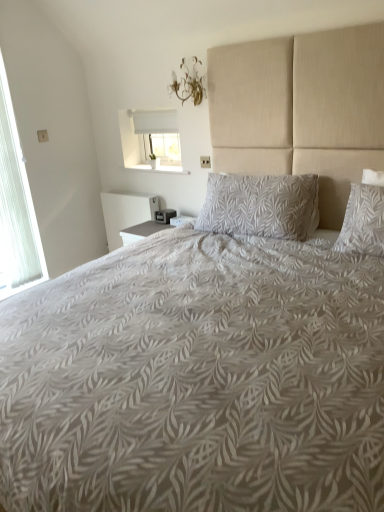
Describe the element at coordinates (261, 206) in the screenshot. This screenshot has width=384, height=512. I see `gray leaf-patterned pillow at center` at that location.

Locate an element on the screen. gray leaf-patterned pillow at center is located at coordinates (261, 206).

Where is `white fabric window at upper center, placed as the first window when sorted from right to left`? This screenshot has width=384, height=512. white fabric window at upper center, placed as the first window when sorted from right to left is located at coordinates (151, 140).

Image resolution: width=384 pixels, height=512 pixels. I want to click on gold metallic chandelier at upper center, so click(x=188, y=83).

The width and height of the screenshot is (384, 512). In order to click on window that appears on the left of white fabric window at upper center, placed as the 2th window when sorted from left to right in this screenshot , I will do `click(16, 206)`.

From the image's perspective, is white sheer curtain at left, which appears as the first window when viewed from the left, located above or below white fabric window at upper center, placed as the 2th window when sorted from left to right?

white sheer curtain at left, which appears as the first window when viewed from the left, is below white fabric window at upper center, placed as the 2th window when sorted from left to right.

Is white sheer curtain at left, which is the 2th window in right-to-left order, looking in the opposite direction of white fabric window at upper center, placed as the 2th window when sorted from left to right?

No, white sheer curtain at left, which is the 2th window in right-to-left order, is not facing the opposite direction of white fabric window at upper center, placed as the 2th window when sorted from left to right.

Which of these two, white fabric window at upper center, placed as the 2th window when sorted from left to right, or gray leaf-patterned pillow at center, is thinner?

white fabric window at upper center, placed as the 2th window when sorted from left to right, is thinner.

Is white fabric window at upper center, placed as the first window when sorted from right to left, facing away from gray leaf-patterned pillow at center?

No, gray leaf-patterned pillow at center is not at the back of white fabric window at upper center, placed as the first window when sorted from right to left.

From a real-world perspective, which object stands above the other?

white fabric window at upper center, placed as the first window when sorted from right to left, from a real-world perspective.

From a real-world perspective, who is located lower, white sheer curtain at left, which appears as the first window when viewed from the left, or gray leaf-patterned pillow at center?

gray leaf-patterned pillow at center.

Which of these two, white sheer curtain at left, which appears as the first window when viewed from the left, or gray leaf-patterned pillow at center, is bigger?

gray leaf-patterned pillow at center.

Which is more to the right, white sheer curtain at left, which appears as the first window when viewed from the left, or gray leaf-patterned pillow at center?

gray leaf-patterned pillow at center is more to the right.

Which object is closer to the camera taking this photo, white sheer curtain at left, which appears as the first window when viewed from the left, or gray leaf-patterned pillow at center?

gray leaf-patterned pillow at center.

This screenshot has height=512, width=384. Find the location of `light fixture behind the white sheer curtain at left, which appears as the first window when viewed from the left`. light fixture behind the white sheer curtain at left, which appears as the first window when viewed from the left is located at coordinates (188, 83).

From the picture: Is gold metallic chandelier at upper center thinner than white sheer curtain at left, which appears as the first window when viewed from the left?

No, gold metallic chandelier at upper center is not thinner than white sheer curtain at left, which appears as the first window when viewed from the left.

Is the surface of gold metallic chandelier at upper center in direct contact with white sheer curtain at left, which appears as the first window when viewed from the left?

They are not placed beside each other.

Who is taller, gray leaf-patterned pillow at center or white sheer curtain at left, which is the 2th window in right-to-left order?

With more height is white sheer curtain at left, which is the 2th window in right-to-left order.

Is point (290, 184) behind point (1, 127)?

No, (290, 184) is closer to viewer.

Is gray leaf-patterned pillow at center far away from white sheer curtain at left, which is the 2th window in right-to-left order?

Absolutely, gray leaf-patterned pillow at center is distant from white sheer curtain at left, which is the 2th window in right-to-left order.

How far apart are gray leaf-patterned pillow at center and white sheer curtain at left, which is the 2th window in right-to-left order?

A distance of 5.66 feet exists between gray leaf-patterned pillow at center and white sheer curtain at left, which is the 2th window in right-to-left order.

Is white fabric window at upper center, placed as the first window when sorted from right to left, with white sheer curtain at left, which appears as the first window when viewed from the left?

white fabric window at upper center, placed as the first window when sorted from right to left, is not next to white sheer curtain at left, which appears as the first window when viewed from the left, and they're not touching.

Could you tell me if white fabric window at upper center, placed as the 2th window when sorted from left to right, is facing white sheer curtain at left, which appears as the first window when viewed from the left?

Yes, white fabric window at upper center, placed as the 2th window when sorted from left to right, is facing white sheer curtain at left, which appears as the first window when viewed from the left.

Is white fabric window at upper center, placed as the first window when sorted from right to left, positioned before white sheer curtain at left, which is the 2th window in right-to-left order?

No, white fabric window at upper center, placed as the first window when sorted from right to left, is further to the viewer.

From a real-world perspective, is white fabric window at upper center, placed as the 2th window when sorted from left to right, below white sheer curtain at left, which appears as the first window when viewed from the left?

Actually, white fabric window at upper center, placed as the 2th window when sorted from left to right, is physically above white sheer curtain at left, which appears as the first window when viewed from the left, in the real world.

From the image's perspective, relative to white fabric window at upper center, placed as the 2th window when sorted from left to right, is gold metallic chandelier at upper center above or below?

gold metallic chandelier at upper center is above white fabric window at upper center, placed as the 2th window when sorted from left to right.

Considering the points (171, 83) and (173, 164), which point is in front, point (171, 83) or point (173, 164)?

The point (171, 83) is closer to the camera.

Considering the relative sizes of gold metallic chandelier at upper center and white fabric window at upper center, placed as the 2th window when sorted from left to right, in the image provided, is gold metallic chandelier at upper center wider than white fabric window at upper center, placed as the 2th window when sorted from left to right,?

Incorrect, the width of gold metallic chandelier at upper center does not surpass that of white fabric window at upper center, placed as the 2th window when sorted from left to right.

Locate an element on the screen. window beneath the white fabric window at upper center, placed as the 2th window when sorted from left to right (from a real-world perspective) is located at coordinates point(16,206).

Find the location of a particular element. The image size is (384, 512). window that is the 1st one when counting leftward from the gray leaf-patterned pillow at center is located at coordinates (151, 140).

From the image, which object appears to be nearer to white sheer curtain at left, which appears as the first window when viewed from the left, gold metallic chandelier at upper center or gray leaf-patterned pillow at center?

The object closer to white sheer curtain at left, which appears as the first window when viewed from the left, is gold metallic chandelier at upper center.

Estimate the real-world distances between objects in this image. Which object is further from white sheer curtain at left, which appears as the first window when viewed from the left, white fabric window at upper center, placed as the 2th window when sorted from left to right, or gray leaf-patterned pillow at center?

gray leaf-patterned pillow at center is further to white sheer curtain at left, which appears as the first window when viewed from the left.

From the image, which object appears to be farther from gray leaf-patterned pillow at center, gold metallic chandelier at upper center or white fabric window at upper center, placed as the first window when sorted from right to left?

white fabric window at upper center, placed as the first window when sorted from right to left, lies further to gray leaf-patterned pillow at center than the other object.

Estimate the real-world distances between objects in this image. Which object is further from gray leaf-patterned pillow at center, white fabric window at upper center, placed as the 2th window when sorted from left to right, or gold metallic chandelier at upper center?

white fabric window at upper center, placed as the 2th window when sorted from left to right, is positioned further to the anchor gray leaf-patterned pillow at center.

When comparing their distances from white sheer curtain at left, which is the 2th window in right-to-left order, does gray leaf-patterned pillow at center or gold metallic chandelier at upper center seem further?

Among the two, gray leaf-patterned pillow at center is located further to white sheer curtain at left, which is the 2th window in right-to-left order.

Which object lies nearer to the anchor point white fabric window at upper center, placed as the 2th window when sorted from left to right, gold metallic chandelier at upper center or gray leaf-patterned pillow at center?

gold metallic chandelier at upper center.

Estimate the real-world distances between objects in this image. Which object is further from white sheer curtain at left, which is the 2th window in right-to-left order, gray leaf-patterned pillow at center or white fabric window at upper center, placed as the 2th window when sorted from left to right?

gray leaf-patterned pillow at center.

When comparing their distances from gray leaf-patterned pillow at center, does white fabric window at upper center, placed as the first window when sorted from right to left, or white sheer curtain at left, which appears as the first window when viewed from the left, seem further?

white sheer curtain at left, which appears as the first window when viewed from the left, lies further to gray leaf-patterned pillow at center than the other object.

Locate an element on the screen. The width and height of the screenshot is (384, 512). light fixture positioned between gray leaf-patterned pillow at center and white fabric window at upper center, placed as the first window when sorted from right to left, from near to far is located at coordinates (188, 83).

Identify the location of window situated between white sheer curtain at left, which appears as the first window when viewed from the left, and gold metallic chandelier at upper center from left to right. This screenshot has width=384, height=512. point(151,140).

Where is `light fixture between white sheer curtain at left, which appears as the first window when viewed from the left, and gray leaf-patterned pillow at center from left to right`? This screenshot has height=512, width=384. light fixture between white sheer curtain at left, which appears as the first window when viewed from the left, and gray leaf-patterned pillow at center from left to right is located at coordinates (188, 83).

Locate an element on the screen. The height and width of the screenshot is (512, 384). window between white sheer curtain at left, which appears as the first window when viewed from the left, and gray leaf-patterned pillow at center is located at coordinates (151, 140).